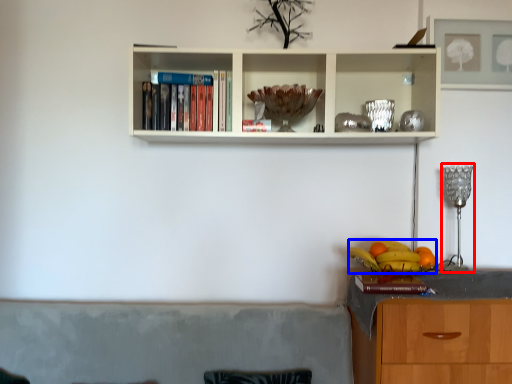
Question: Which object is closer to the camera taking this photo, lamp (highlighted by a red box) or fruit (highlighted by a blue box)?

Choices:
 (A) lamp
 (B) fruit

Answer: (B)